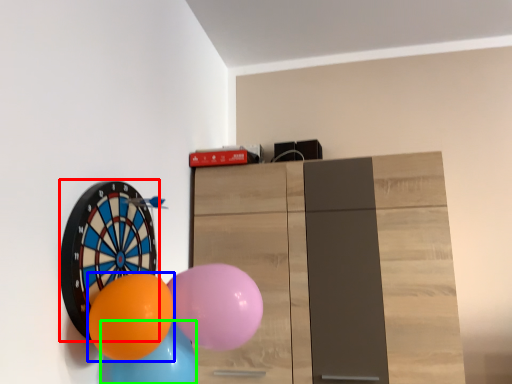
Question: Which object is positioned farthest from balloon (highlighted by a red box)? Select from balloon (highlighted by a blue box) and balloon (highlighted by a green box).

Choices:
 (A) balloon
 (B) balloon

Answer: (B)